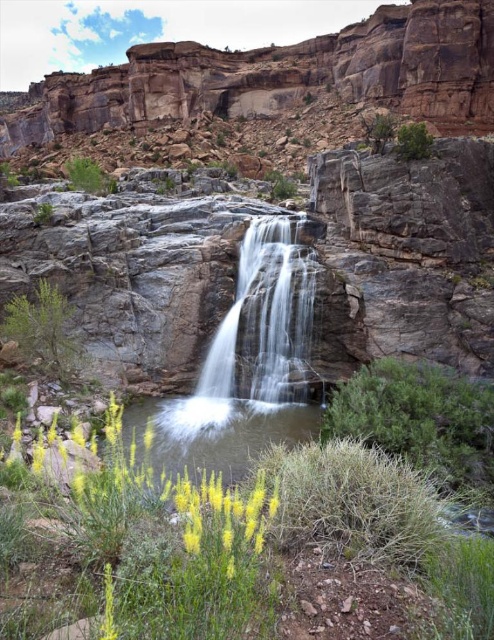
Question: Considering the relative positions of white smooth waterfall at center and green leafy shrub at upper left in the image provided, where is white smooth waterfall at center located with respect to green leafy shrub at upper left?

Choices:
 (A) above
 (B) below

Answer: (B)

Question: Which object is positioned closest to the green leafy shrub at left?

Choices:
 (A) green leafy bush at lower right
 (B) green leafy shrub at upper left
 (C) white smooth waterfall at center

Answer: (C)

Question: Can you confirm if white smooth waterfall at center is positioned above green leafy bush at lower right?

Choices:
 (A) no
 (B) yes

Answer: (B)

Question: Estimate the real-world distances between objects in this image. Which object is closer to the green leafy shrub at upper left?

Choices:
 (A) green leafy bush at lower right
 (B) white smooth waterfall at center
 (C) green leafy bush at upper right

Answer: (B)

Question: Can you confirm if green leafy shrub at left is smaller than green leafy shrub at upper left?

Choices:
 (A) yes
 (B) no

Answer: (A)

Question: Which point appears farthest from the camera in this image?

Choices:
 (A) (402, 360)
 (B) (89, 172)
 (C) (401, 140)

Answer: (B)